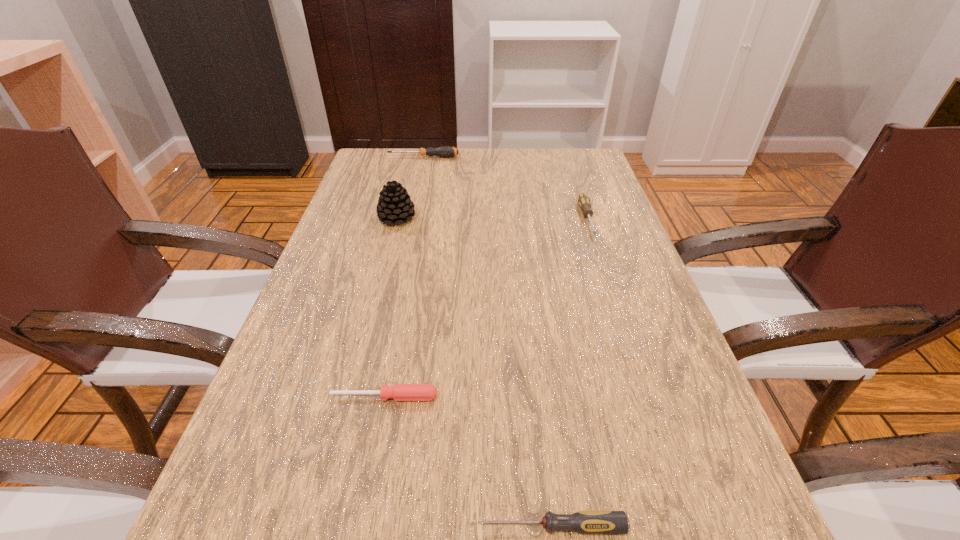
Find the location of `pinecone`. pinecone is located at coordinates (394, 204).

I want to click on the farthest screwdriver, so click(446, 151).

Find the location of a particular element. The width and height of the screenshot is (960, 540). the rightmost screwdriver is located at coordinates (583, 200).

This screenshot has width=960, height=540. I want to click on the rightmost object, so click(x=583, y=200).

This screenshot has height=540, width=960. What are the coordinates of `the second object from right to left` in the screenshot? It's located at (584, 522).

Locate an element on the screen. Image resolution: width=960 pixels, height=540 pixels. the third screwdriver from left to right is located at coordinates pyautogui.click(x=584, y=522).

Identify the location of the third farthest screwdriver. The width and height of the screenshot is (960, 540). [400, 392].

The height and width of the screenshot is (540, 960). What are the coordinates of `vacant region located 0.220m at the narrow end of the tallest object` in the screenshot? It's located at (501, 218).

The width and height of the screenshot is (960, 540). I want to click on vacant space located 0.290m on the right of the farthest screwdriver, so click(550, 157).

The image size is (960, 540). In order to click on blank space located at the tip of the rightmost screwdriver in this screenshot , I will do `click(615, 304)`.